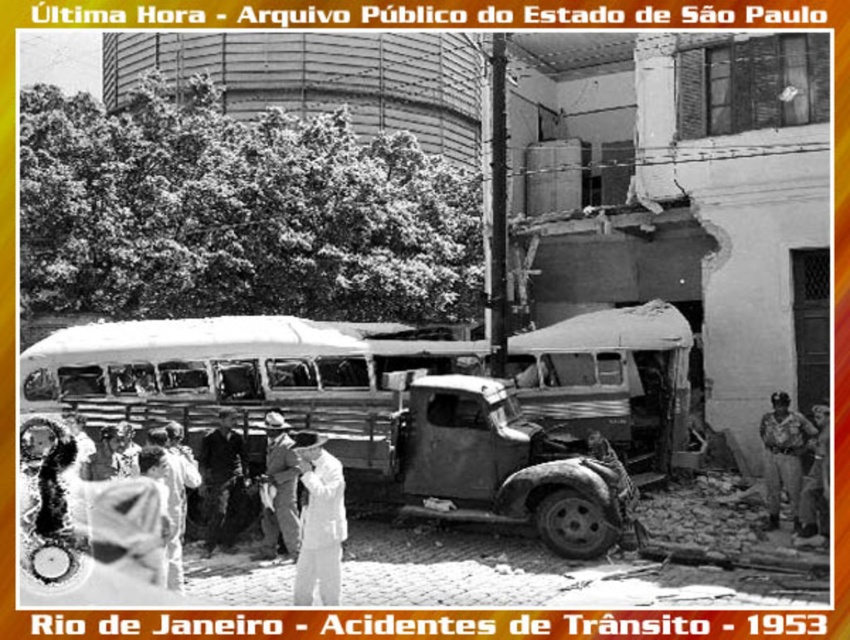
You are a pedestrian trying to cross the street in this chaotic scene. There are two points marked on the image. One is at point (204,497) and the other is at point (298,525). Which point is closer to the damaged truck in the foreground?

Point (204,497) is behind point (298,525), so the point closer to the damaged truck in the foreground is point (298,525).

You are a pedestrian standing at the edge of the scene. You see the rusty metal truck at center and the light brown leather hat at center. Which object is positioned higher from the ground?

The rusty metal truck at center is located above the light brown leather hat at center, so the truck is higher up.